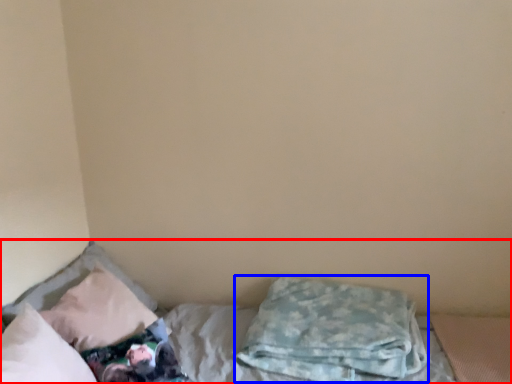
Question: Which object is further to the camera taking this photo, bed (highlighted by a red box) or pillow (highlighted by a blue box)?

Choices:
 (A) bed
 (B) pillow

Answer: (B)